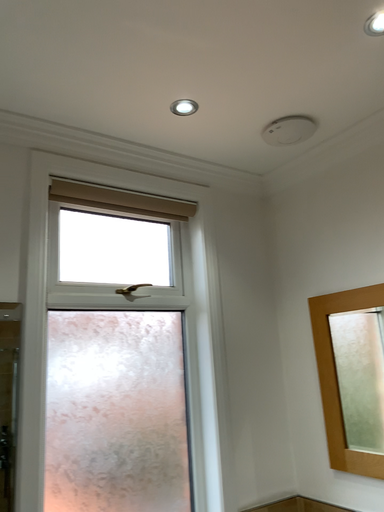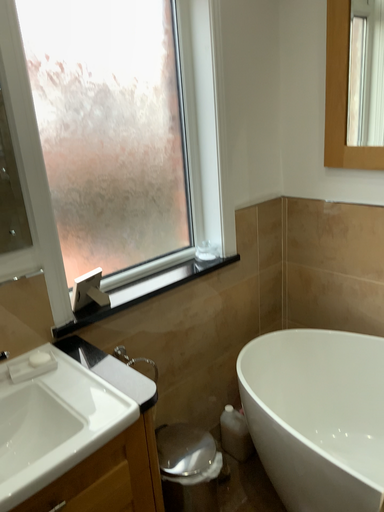
Question: Which way did the camera rotate in the video?

Choices:
 (A) rotated left
 (B) rotated right

Answer: (B)